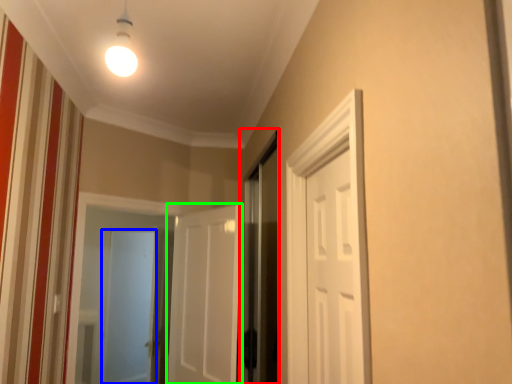
Question: Which object is the farthest from screen door (highlighted by a red box)? Choose among these: screen door (highlighted by a blue box) or door (highlighted by a green box).

Choices:
 (A) screen door
 (B) door

Answer: (A)